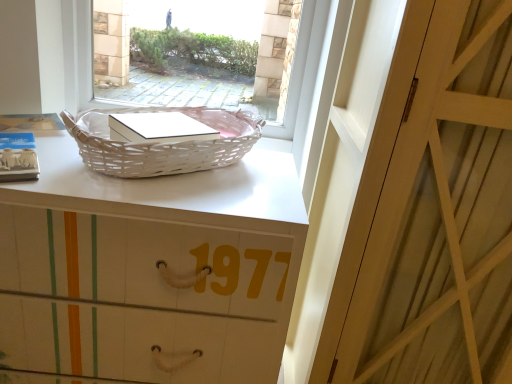
Question: Is white wood door at center oriented away from white matte basket at upper center?

Choices:
 (A) yes
 (B) no

Answer: (B)

Question: Can you confirm if white wood door at center is thinner than white matte basket at upper center?

Choices:
 (A) yes
 (B) no

Answer: (B)

Question: Is white wood door at center at the left side of white matte basket at upper center?

Choices:
 (A) no
 (B) yes

Answer: (A)

Question: Is white wood door at center taller than white matte basket at upper center?

Choices:
 (A) no
 (B) yes

Answer: (B)

Question: Is white matte basket at upper center inside white wood door at center?

Choices:
 (A) no
 (B) yes

Answer: (A)

Question: From a real-world perspective, is white wood door at center below white matte basket at upper center?

Choices:
 (A) yes
 (B) no

Answer: (B)

Question: Can you confirm if white matte basket at upper center is wider than white wicker basket at upper center?

Choices:
 (A) yes
 (B) no

Answer: (A)

Question: From a real-world perspective, is white matte basket at upper center over white wicker basket at upper center?

Choices:
 (A) yes
 (B) no

Answer: (B)

Question: Does white matte basket at upper center come in front of white wicker basket at upper center?

Choices:
 (A) no
 (B) yes

Answer: (B)

Question: Does white matte basket at upper center have a greater height compared to white wicker basket at upper center?

Choices:
 (A) no
 (B) yes

Answer: (B)

Question: Is white wicker basket at upper center at the back of white matte basket at upper center?

Choices:
 (A) no
 (B) yes

Answer: (A)

Question: Does white matte basket at upper center have a smaller size compared to white wicker basket at upper center?

Choices:
 (A) no
 (B) yes

Answer: (A)

Question: Is white wicker basket at upper center not within white wood door at center?

Choices:
 (A) no
 (B) yes

Answer: (B)